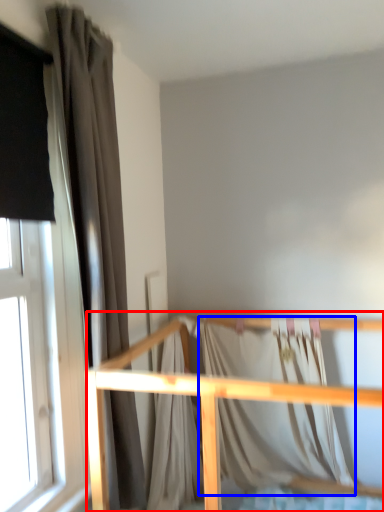
Question: Which of the following is the closest to the observer, rail (highlighted by a red box) or blanket (highlighted by a blue box)?

Choices:
 (A) rail
 (B) blanket

Answer: (A)